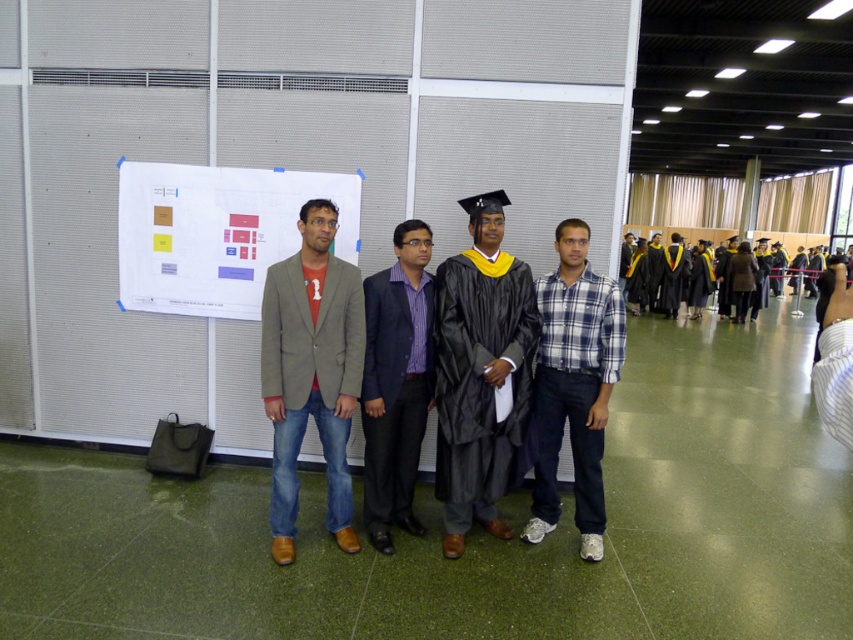
Question: Estimate the real-world distances between objects in this image. Which object is farther from the black matte graduation gown at center?

Choices:
 (A) purple satin blazer at center
 (B) white paper at upper center

Answer: (B)

Question: Is matte gray blazer at center above blue plaid shirt at center?

Choices:
 (A) yes
 (B) no

Answer: (A)

Question: Does blue plaid shirt at center have a larger size compared to purple satin blazer at center?

Choices:
 (A) no
 (B) yes

Answer: (B)

Question: Which point is farther to the camera?

Choices:
 (A) blue plaid shirt at center
 (B) purple satin blazer at center
 (C) matte gray blazer at center
 (D) black matte graduation gown at center

Answer: (B)

Question: Which point is farther to the camera?

Choices:
 (A) (233, 241)
 (B) (370, 515)

Answer: (A)

Question: Observing the image, what is the correct spatial positioning of black matte graduation gown at center in reference to purple satin blazer at center?

Choices:
 (A) above
 (B) below

Answer: (A)